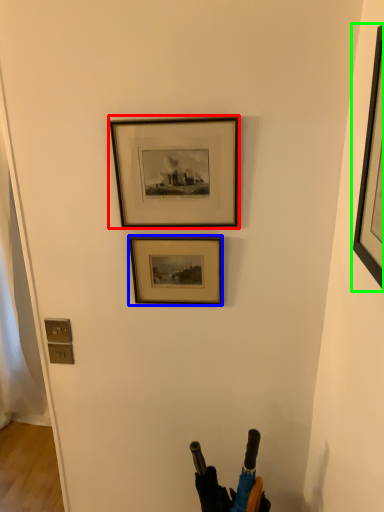
Question: Which object is positioned farthest from picture frame (highlighted by a red box)? Select from picture frame (highlighted by a blue box) and picture frame (highlighted by a green box).

Choices:
 (A) picture frame
 (B) picture frame

Answer: (B)